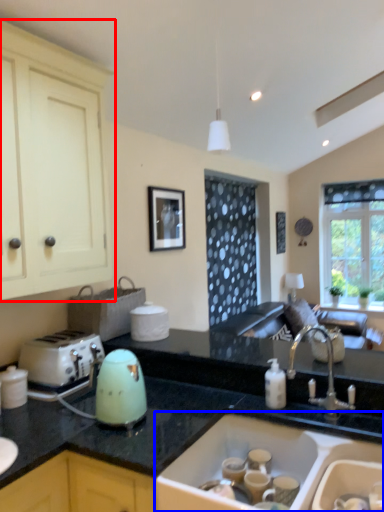
Question: Which point is closer to the camera, cabinetry (highlighted by a red box) or sink (highlighted by a blue box)?

Choices:
 (A) cabinetry
 (B) sink

Answer: (B)